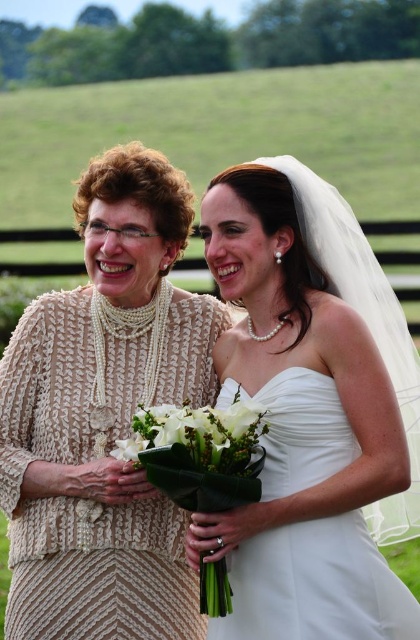
You are a photographer at a wedding and need to position a light source to the right of both the knitted beige dress at left and the white fabric bouquet at center. Is this possible given their positions?

The knitted beige dress at left is to the left of the white fabric bouquet at center, so placing a light source to the right of both is possible as they are arranged from left to right as knitted beige dress at left followed by white fabric bouquet at center.

You are a photographer setting up for a wedding photo. You have two focal points in the image, the knitted beige dress at left and the white matte flower at center. Based on their sizes, which focal point should you prioritize to ensure it stands out more in the composition?

The knitted beige dress at left is larger in size than the white matte flower at center, so you should prioritize the knitted beige dress at left to ensure it stands out more in the composition.

You are a photographer setting up for a group photo. You have two subjects in front of you, the knitted beige dress at left and the white fabric bouquet at center. Based on their sizes, which object should you focus on first if you want to ensure both are in frame without cropping?

The knitted beige dress at left is larger in size than the white fabric bouquet at center, so you should focus on the knitted beige dress at left first to ensure it fits within the frame, then adjust for the smaller bouquet.